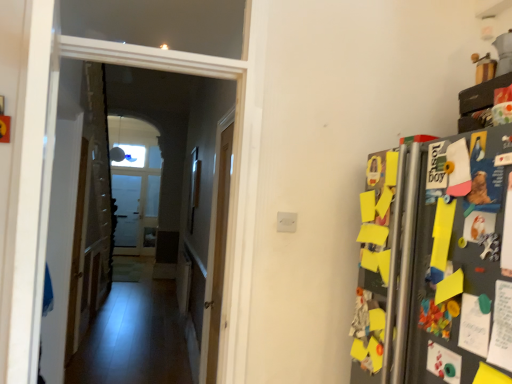
Question: From a real-world perspective, is light wood door at center above or below smooth wooden floor at center?

Choices:
 (A) below
 (B) above

Answer: (A)

Question: Considering the positions of light wood door at center and smooth wooden floor at center in the image, is light wood door at center wider or thinner than smooth wooden floor at center?

Choices:
 (A) wide
 (B) thin

Answer: (A)

Question: Is light wood door at center inside the boundaries of smooth wooden floor at center, or outside?

Choices:
 (A) inside
 (B) outside

Answer: (B)

Question: Relative to light wood door at center, is smooth wooden floor at center in front or behind?

Choices:
 (A) front
 (B) behind

Answer: (A)

Question: Visually, is smooth wooden floor at center positioned to the left or to the right of light wood door at center?

Choices:
 (A) left
 (B) right

Answer: (A)

Question: Considering the positions of smooth wooden floor at center and light wood door at center in the image, is smooth wooden floor at center bigger or smaller than light wood door at center?

Choices:
 (A) small
 (B) big

Answer: (A)

Question: Is smooth wooden floor at center wider or thinner than light wood door at center?

Choices:
 (A) thin
 (B) wide

Answer: (A)